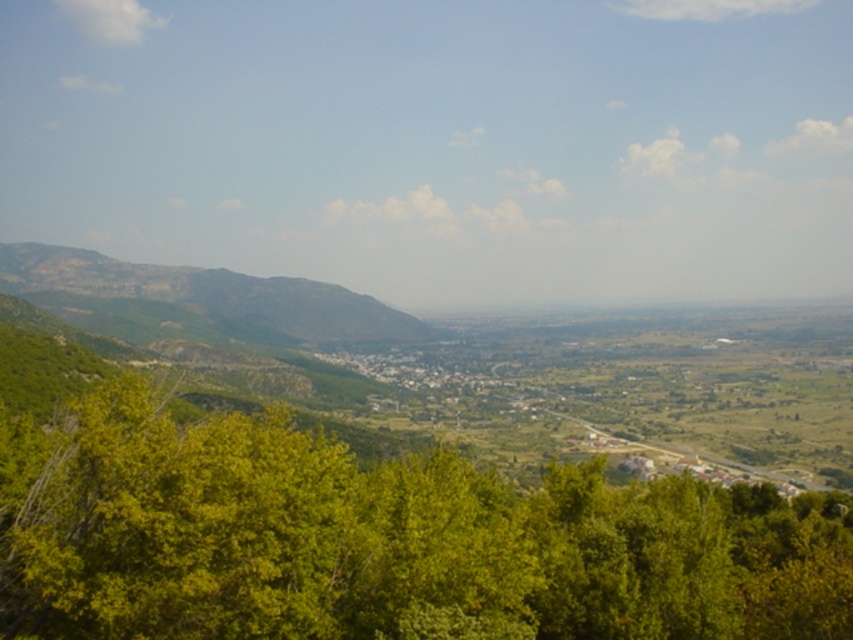
Question: In this image, where is green leafy tree at lower center located relative to rocky brown mountain at left?

Choices:
 (A) above
 (B) below

Answer: (B)

Question: Is green leafy tree at lower center above rocky brown mountain at left?

Choices:
 (A) no
 (B) yes

Answer: (A)

Question: Can you confirm if green leafy tree at lower center is bigger than rocky brown mountain at left?

Choices:
 (A) no
 (B) yes

Answer: (A)

Question: Among these points, which one is farthest from the camera?

Choices:
 (A) pos(230,522)
 (B) pos(364,339)

Answer: (B)